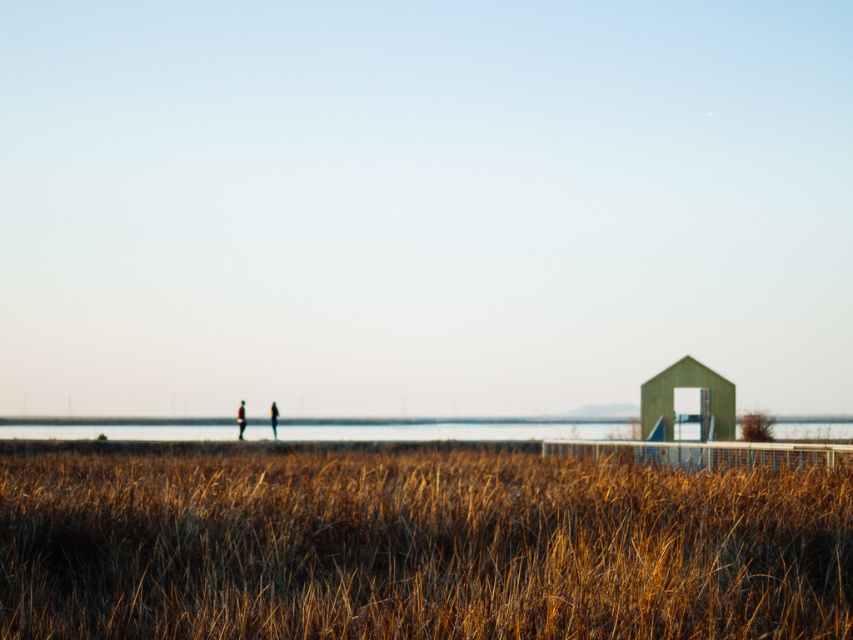
Can you confirm if clear water at center is smaller than matte brown jacket at center?

No, clear water at center is not smaller than matte brown jacket at center.

Who is positioned more to the right, clear water at center or matte brown jacket at center?

clear water at center

This screenshot has height=640, width=853. I want to click on clear water at center, so click(x=456, y=429).

This screenshot has width=853, height=640. What do you see at coordinates (416, 547) in the screenshot?
I see `brown dry grass at lower center` at bounding box center [416, 547].

Identify the location of brown dry grass at lower center. click(416, 547).

Is point (788, 536) closer to viewer compared to point (270, 422)?

Yes, point (788, 536) is in front of point (270, 422).

Can you confirm if brown dry grass at lower center is bigger than matte black person at center?

Correct, brown dry grass at lower center is larger in size than matte black person at center.

The width and height of the screenshot is (853, 640). What do you see at coordinates (416, 547) in the screenshot?
I see `brown dry grass at lower center` at bounding box center [416, 547].

This screenshot has height=640, width=853. Find the location of `brown dry grass at lower center`. brown dry grass at lower center is located at coordinates (416, 547).